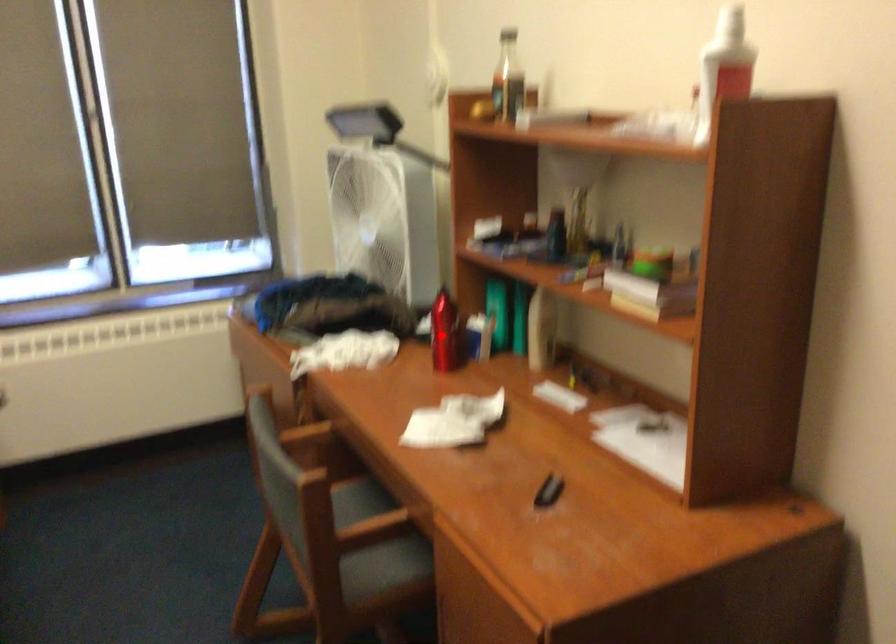
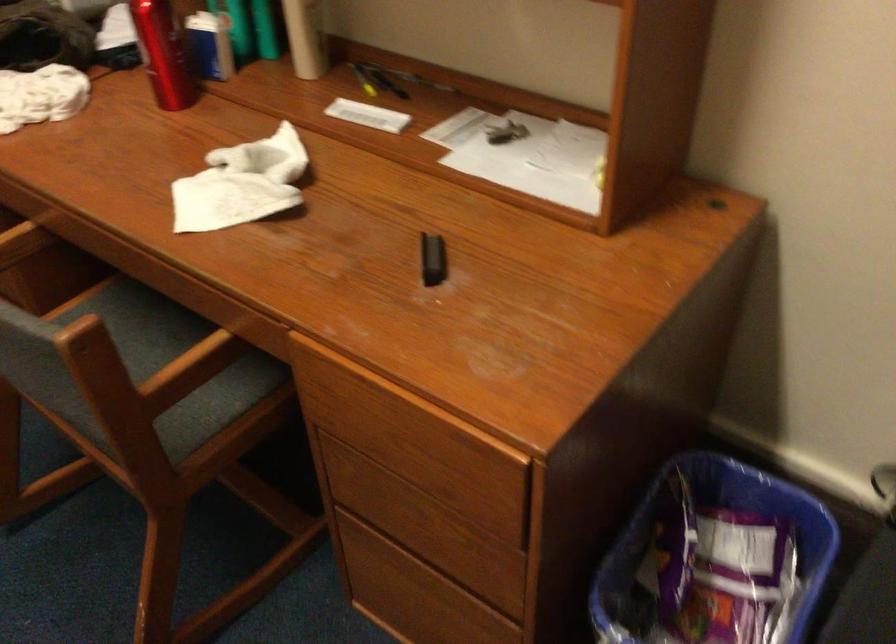
Where in the second image is the point corresponding to the highlighted location from the first image?

(162, 53)